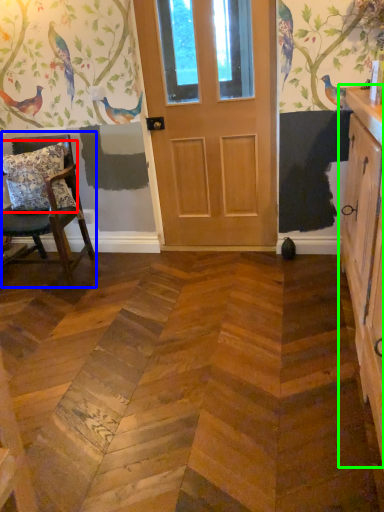
Question: Based on their relative distances, which object is farther from pillow (highlighted by a red box)? Choose from chair (highlighted by a blue box) and cabinetry (highlighted by a green box).

Choices:
 (A) chair
 (B) cabinetry

Answer: (B)